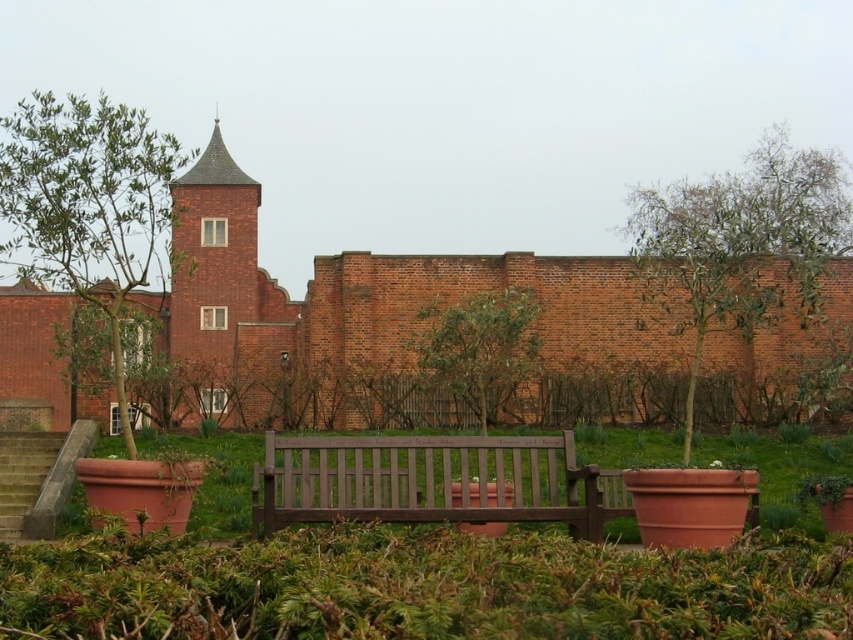
Is dark brown wooden bench at center thinner than concrete stairs at lower left?

Incorrect, dark brown wooden bench at center's width is not less than concrete stairs at lower left's.

Is point (474, 500) positioned after point (18, 524)?

No, (474, 500) is in front of (18, 524).

Measure the distance between dark brown wooden bench at center and camera.

dark brown wooden bench at center is 23.34 meters from camera.

Identify the location of dark brown wooden bench at center. (431, 481).